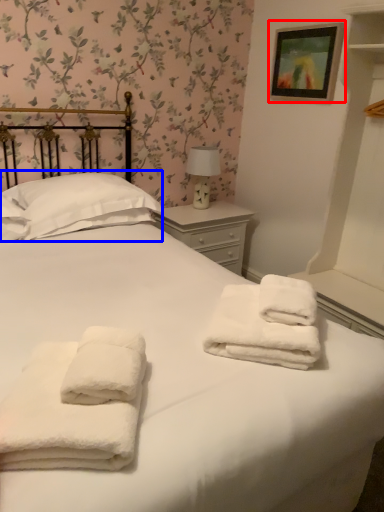
Question: Which object appears closest to the camera in this image, picture frame (highlighted by a red box) or pillow (highlighted by a blue box)?

Choices:
 (A) picture frame
 (B) pillow

Answer: (B)